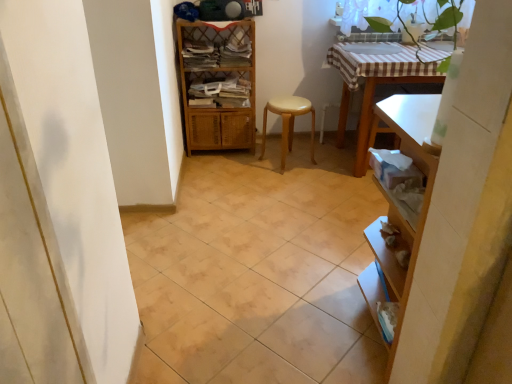
Question: Is point (309, 150) closer or farther from the camera than point (211, 238)?

Choices:
 (A) farther
 (B) closer

Answer: (A)

Question: Choose the correct answer: Is light brown wooden stool at center inside beige ceramic tile at center or outside it?

Choices:
 (A) inside
 (B) outside

Answer: (B)

Question: Estimate the real-world distances between objects in this image. Which object is farther from the woven wood shelf at center?

Choices:
 (A) beige ceramic tile at center
 (B) white glossy sink at upper center
 (C) light brown wooden stool at center

Answer: (A)

Question: Estimate the real-world distances between objects in this image. Which object is closer to the woven wood shelf at center?

Choices:
 (A) light brown wooden stool at center
 (B) beige ceramic tile at center
 (C) white glossy sink at upper center

Answer: (A)